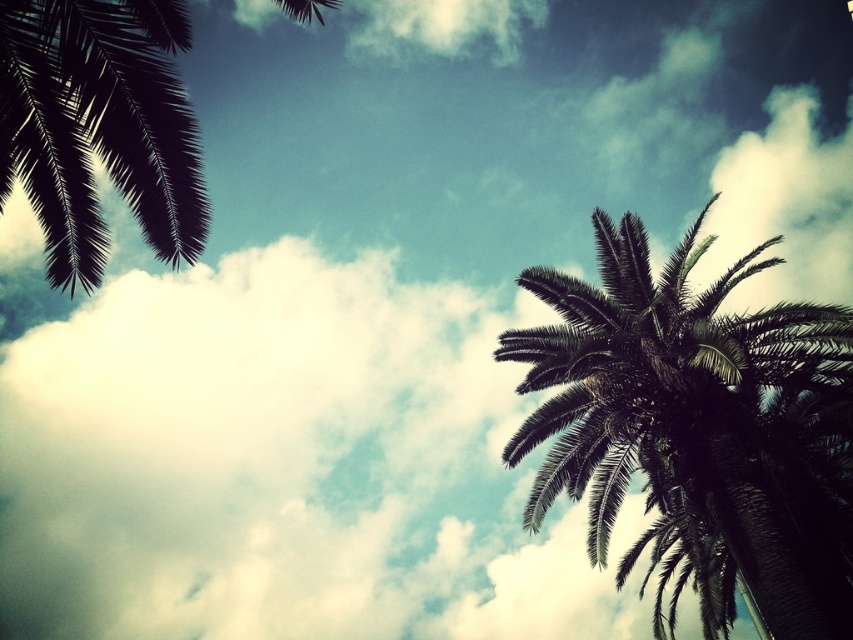
Looking at this image, you are standing in a garden and want to take a photo of the dark green leafy palm tree at right without the dark green leafy palm tree at upper left appearing in the background. Is this possible based on their positions?

The dark green leafy palm tree at upper left is behind the dark green leafy palm tree at right, so if you position yourself so that the dark green leafy palm tree at right is between you and the dark green leafy palm tree at upper left, you can take the photo without the upper left tree in the background.

You are a bird looking for a place to perch. You see the dark green leafy palm tree at right and the dark green leafy palm tree at upper left. Which tree has a narrower canopy for you to land on?

The dark green leafy palm tree at right has a lesser width compared to the dark green leafy palm tree at upper left, so it has a narrower canopy for you to land on.